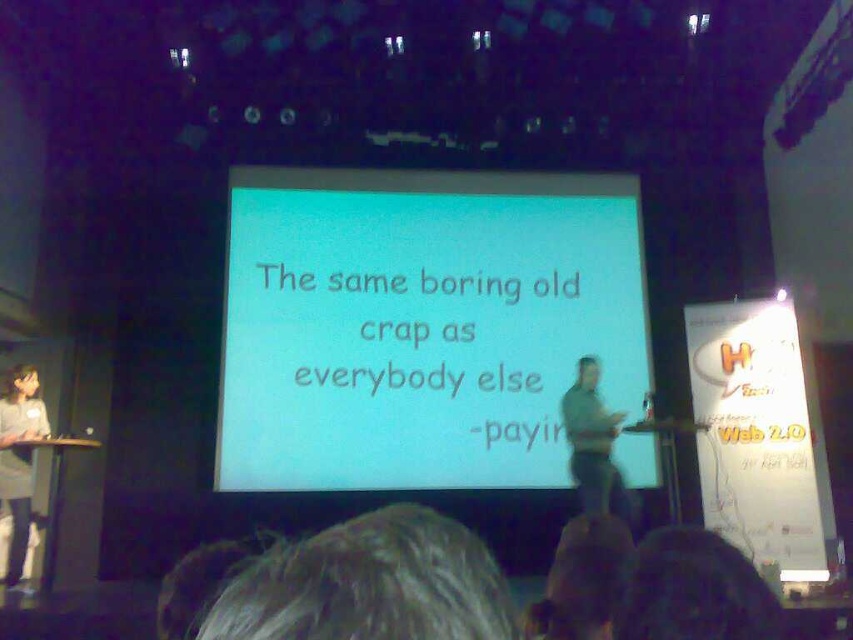
What are the coordinates of the white matte projection screen at center?

The white matte projection screen at center is located at point (421,324).

You are an attendee in the presentation and you want to take a photo of the speaker. The camera you have can only focus on objects wider than 30cm. Which object between the blonde hair at lower center and the green fabric shirt at center should you focus on to ensure proper focus?

The green fabric shirt at center is wider than the blonde hair at lower center, so focusing on the green fabric shirt at center ensures proper focus since it is wider than 30cm.

Based on the photo, you are sitting in the front row of the auditorium and notice two elements in the scene. One is the blonde hair at lower center and the other is the green fabric shirt at center. Which of these two elements is positioned closer to you?

The blonde hair at lower center is closer to the viewer than the green fabric shirt at center.